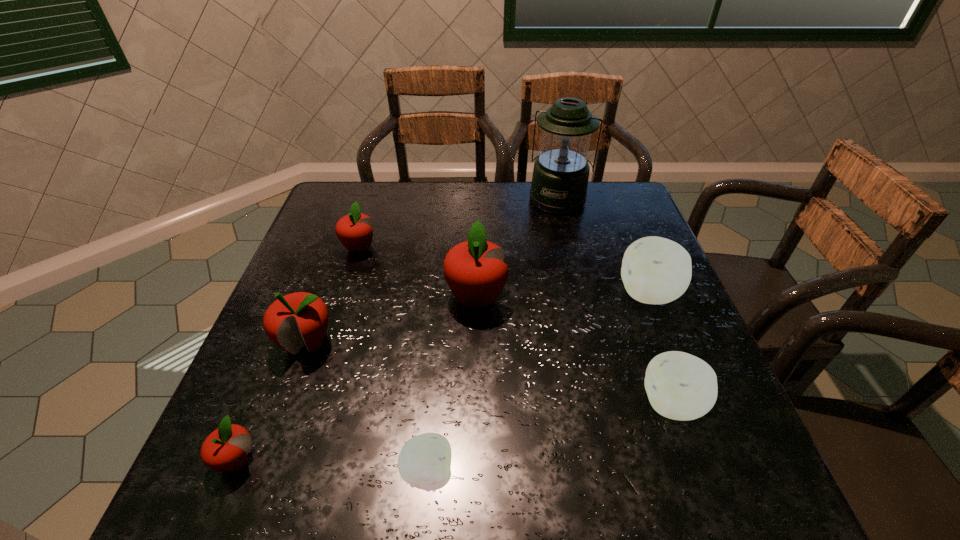
At what (x,y) coordinates should I click in order to perform the action: click on vacant space located on the back of the leftmost white apple. Please return your answer as a coordinate pair (x, y). Looking at the image, I should click on (441, 326).

The width and height of the screenshot is (960, 540). In order to click on free spot located 0.400m on the right of the nearest red apple in this screenshot , I will do `click(490, 460)`.

Where is `object that is positioned at the far edge`? The height and width of the screenshot is (540, 960). object that is positioned at the far edge is located at coordinates (560, 177).

Where is `lantern present at the right edge`? The height and width of the screenshot is (540, 960). lantern present at the right edge is located at coordinates (560, 177).

I want to click on object located in the near left corner section of the desktop, so click(226, 448).

The width and height of the screenshot is (960, 540). I want to click on object present at the far right corner, so click(x=560, y=177).

This screenshot has width=960, height=540. In order to click on vacant area at the far edge in this screenshot , I will do `click(505, 188)`.

Find the location of a particular element. The width and height of the screenshot is (960, 540). free spot at the left edge of the desktop is located at coordinates (270, 406).

I want to click on vacant space at the far right corner of the desktop, so click(x=627, y=219).

Where is `free space between the smallest red apple and the second biggest white apple`? The height and width of the screenshot is (540, 960). free space between the smallest red apple and the second biggest white apple is located at coordinates (454, 432).